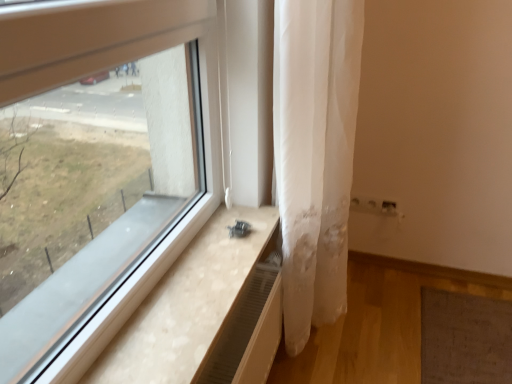
Identify the location of light wood/texture window sill at lower left. (185, 305).

What do you see at coordinates (185, 305) in the screenshot? I see `light wood/texture window sill at lower left` at bounding box center [185, 305].

The width and height of the screenshot is (512, 384). What do you see at coordinates (315, 154) in the screenshot?
I see `white sheer curtain at center` at bounding box center [315, 154].

Where is `white sheer curtain at center`? The width and height of the screenshot is (512, 384). white sheer curtain at center is located at coordinates (315, 154).

The width and height of the screenshot is (512, 384). Find the location of `light wood/texture window sill at lower left`. light wood/texture window sill at lower left is located at coordinates (185, 305).

Which object is positioned more to the left, white sheer curtain at center or light wood/texture window sill at lower left?

light wood/texture window sill at lower left is more to the left.

Does white sheer curtain at center come behind light wood/texture window sill at lower left?

→ Yes, white sheer curtain at center is behind light wood/texture window sill at lower left.

Which is closer, (345, 197) or (192, 329)?

Point (345, 197) is farther from the camera than point (192, 329).

From the image's perspective, is white sheer curtain at center above light wood/texture window sill at lower left?

Yes.

From a real-world perspective, is white sheer curtain at center physically located above or below light wood/texture window sill at lower left?

white sheer curtain at center is above light wood/texture window sill at lower left.

Is white sheer curtain at center wider than light wood/texture window sill at lower left?

No.

Who is taller, white sheer curtain at center or light wood/texture window sill at lower left?

With more height is white sheer curtain at center.

Which of these two, white sheer curtain at center or light wood/texture window sill at lower left, is bigger?

white sheer curtain at center is bigger.

Based on the photo, is white sheer curtain at center inside the boundaries of light wood/texture window sill at lower left, or outside?

white sheer curtain at center is outside light wood/texture window sill at lower left.

Is white sheer curtain at center directly adjacent to light wood/texture window sill at lower left?

No, white sheer curtain at center is not making contact with light wood/texture window sill at lower left.

Is white sheer curtain at center facing towards light wood/texture window sill at lower left?

No, white sheer curtain at center is not turned towards light wood/texture window sill at lower left.

Can you tell me how much white sheer curtain at center and light wood/texture window sill at lower left differ in facing direction?

white sheer curtain at center and light wood/texture window sill at lower left are facing 0.58 degrees away from each other.

Find the location of a particular element. Image resolution: width=512 pixels, height=384 pixels. curtain behind the light wood/texture window sill at lower left is located at coordinates (315, 154).

Considering the positions of objects light wood/texture window sill at lower left and white sheer curtain at center in the image provided, who is more to the right, light wood/texture window sill at lower left or white sheer curtain at center?

white sheer curtain at center is more to the right.

Does light wood/texture window sill at lower left lie in front of white sheer curtain at center?

That is True.

Considering the positions of point (197, 283) and point (274, 102), is point (197, 283) closer or farther from the camera than point (274, 102)?

Point (197, 283).

From the image's perspective, is light wood/texture window sill at lower left positioned above or below white sheer curtain at center?

Clearly, from the image's perspective, light wood/texture window sill at lower left is below white sheer curtain at center.

From a real-world perspective, is light wood/texture window sill at lower left physically below white sheer curtain at center?

Yes, from a real-world perspective, light wood/texture window sill at lower left is below white sheer curtain at center.

Is light wood/texture window sill at lower left thinner than white sheer curtain at center?

No.

Considering the sizes of objects light wood/texture window sill at lower left and white sheer curtain at center in the image provided, who is taller, light wood/texture window sill at lower left or white sheer curtain at center?

white sheer curtain at center.

Between light wood/texture window sill at lower left and white sheer curtain at center, which one has larger size?

Bigger between the two is white sheer curtain at center.

Can white sheer curtain at center be found inside light wood/texture window sill at lower left?

No, white sheer curtain at center is not surrounded by light wood/texture window sill at lower left.

Would you consider light wood/texture window sill at lower left to be distant from white sheer curtain at center?

light wood/texture window sill at lower left is near white sheer curtain at center, not far away.

Is light wood/texture window sill at lower left oriented away from white sheer curtain at center?

That's not correct — light wood/texture window sill at lower left is not looking away from white sheer curtain at center.

How different are the orientations of light wood/texture window sill at lower left and white sheer curtain at center in degrees?

The angle between the facing direction of light wood/texture window sill at lower left and the facing direction of white sheer curtain at center is 0.58 degrees.

Find the location of a particular element. The image size is (512, 384). window sill below the white sheer curtain at center (from the image's perspective) is located at coordinates (185, 305).

The image size is (512, 384). What are the coordinates of `window sill directly beneath the white sheer curtain at center (from a real-world perspective)` in the screenshot? It's located at (185, 305).

You are a GUI agent. You are given a task and a screenshot of the screen. Output one action in this format:
    pyautogui.click(x=<x>, y=<y>)
    Task: Click on the window sill located in front of the white sheer curtain at center
    This screenshot has height=384, width=512.
    Given the screenshot: What is the action you would take?
    pyautogui.click(x=185, y=305)